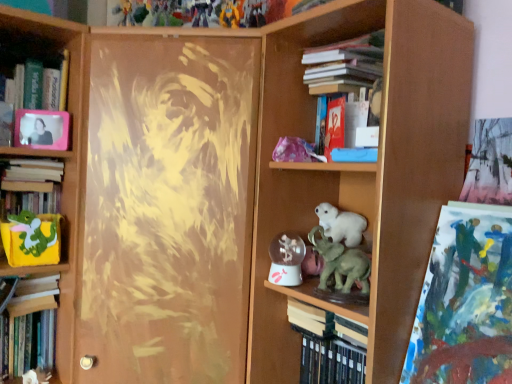
Question: Is hardcover book at left, which is the third book from bottom to top, not inside matte green plush toy at left, which is the 2th animal from front to back?

Choices:
 (A) no
 (B) yes

Answer: (B)

Question: From a real-world perspective, is hardcover book at left, which is the third book from bottom to top, located beneath matte green plush toy at left, acting as the 2th animal starting from the right?

Choices:
 (A) yes
 (B) no

Answer: (B)

Question: Is hardcover book at left, which is the 2th book in left-to-right order, bigger than matte green plush toy at left, acting as the 1th animal starting from the back?

Choices:
 (A) yes
 (B) no

Answer: (A)

Question: Is hardcover book at left, which is the 2th book in left-to-right order, smaller than matte green plush toy at left, positioned as the 1th animal in left-to-right order?

Choices:
 (A) yes
 (B) no

Answer: (B)

Question: Is hardcover book at left, positioned as the fourth book in right-to-left order, wider than matte green plush toy at left, positioned as the 1th animal in left-to-right order?

Choices:
 (A) yes
 (B) no

Answer: (A)

Question: Considering the positions of green matte elephant at center, marked as the first animal in a front-to-back arrangement, and hardcover book at left, which is the 2th book in left-to-right order, in the image, is green matte elephant at center, marked as the first animal in a front-to-back arrangement, wider or thinner than hardcover book at left, which is the 2th book in left-to-right order,?

Choices:
 (A) thin
 (B) wide

Answer: (A)

Question: Is green matte elephant at center, placed as the second animal when sorted from left to right, in front of or behind hardcover book at left, which is the 2th book in left-to-right order, in the image?

Choices:
 (A) front
 (B) behind

Answer: (A)

Question: Is green matte elephant at center, the first animal in the right-to-left sequence, bigger or smaller than hardcover book at left, which is the third book from bottom to top?

Choices:
 (A) small
 (B) big

Answer: (A)

Question: Choose the correct answer: Is green matte elephant at center, marked as the first animal in a front-to-back arrangement, inside hardcover book at left, the third book from the top, or outside it?

Choices:
 (A) inside
 (B) outside

Answer: (B)

Question: From the image's perspective, is hardcover book at upper right, which ranks as the fifth book in bottom-to-top order, located above or below red matte book at upper center, the 2th paperback book when ordered from bottom to top?

Choices:
 (A) below
 (B) above

Answer: (B)

Question: Is hardcover book at upper right, the 1th book viewed from the top, bigger or smaller than red matte book at upper center, which is the first paperback book from top to bottom?

Choices:
 (A) big
 (B) small

Answer: (A)

Question: From their relative heights in the image, would you say hardcover book at upper right, which ranks as the fifth book in bottom-to-top order, is taller or shorter than red matte book at upper center, which is the first paperback book from top to bottom?

Choices:
 (A) short
 (B) tall

Answer: (A)

Question: Would you say hardcover book at upper right, the 1th book viewed from the top, is to the left or to the right of red matte book at upper center, the 1th paperback book when ordered from front to back, in the picture?

Choices:
 (A) left
 (B) right

Answer: (B)

Question: Considering their positions, is red matte book at upper center, the 1th paperback book when ordered from front to back, located in front of or behind abstract acrylic painting at upper right?

Choices:
 (A) front
 (B) behind

Answer: (B)

Question: Is red matte book at upper center, the 1th paperback book when ordered from front to back, to the left or to the right of abstract acrylic painting at upper right in the image?

Choices:
 (A) right
 (B) left

Answer: (B)